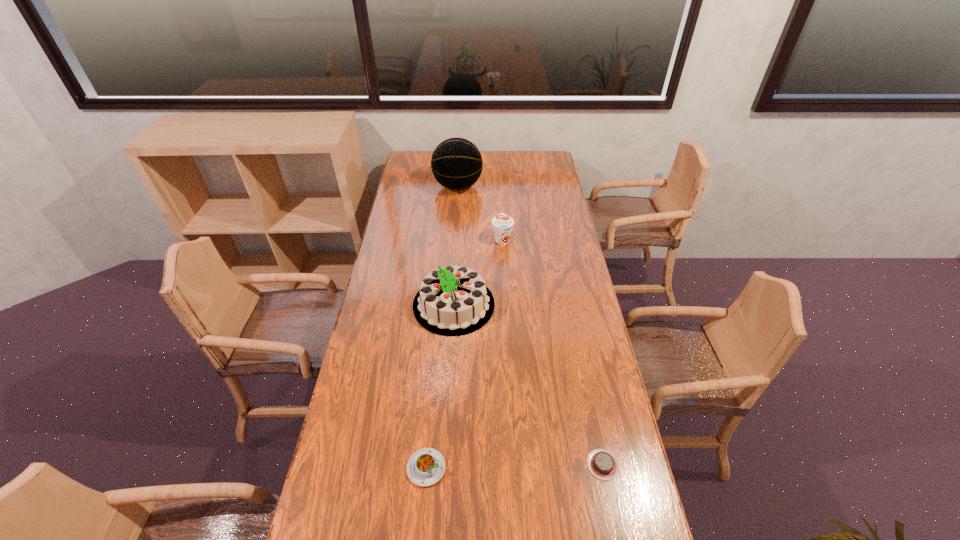
The height and width of the screenshot is (540, 960). In order to click on the tallest object in this screenshot , I will do `click(456, 163)`.

Where is `basketball`? The image size is (960, 540). basketball is located at coordinates (456, 163).

Image resolution: width=960 pixels, height=540 pixels. What are the coordinates of `the fourth shortest object` in the screenshot? It's located at (454, 300).

I want to click on the third farthest object, so click(x=454, y=300).

Locate an element on the screen. The width and height of the screenshot is (960, 540). yogurt is located at coordinates (502, 223).

This screenshot has height=540, width=960. I want to click on the third tallest object, so click(x=502, y=223).

Where is `the second shortest object`? This screenshot has height=540, width=960. the second shortest object is located at coordinates (425, 467).

At what (x,y) coordinates should I click in order to perform the action: click on the shortest object. Please return your answer as a coordinate pair (x, y). The width and height of the screenshot is (960, 540). Looking at the image, I should click on (602, 464).

Find the location of a particular element. This screenshot has height=540, width=960. chocolate cake is located at coordinates (602, 464).

Locate an element on the screen. vacant point located 0.180m on the right of the basketball is located at coordinates (516, 186).